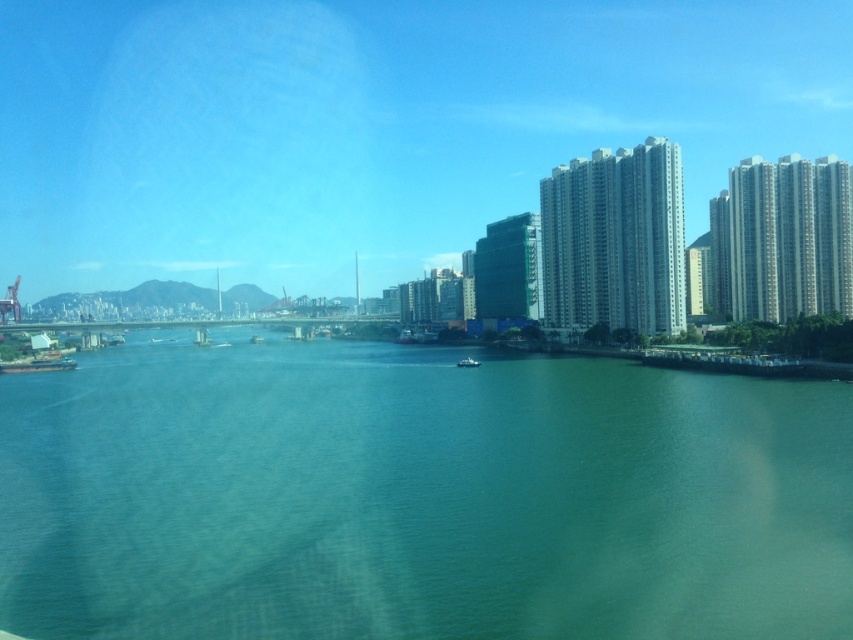
Is point (561, 490) positioned after point (471, 368)?

No.

Does green water at center appear over white matte boat at center?

Incorrect, green water at center is not positioned above white matte boat at center.

Find the location of a particular element. green water at center is located at coordinates (416, 497).